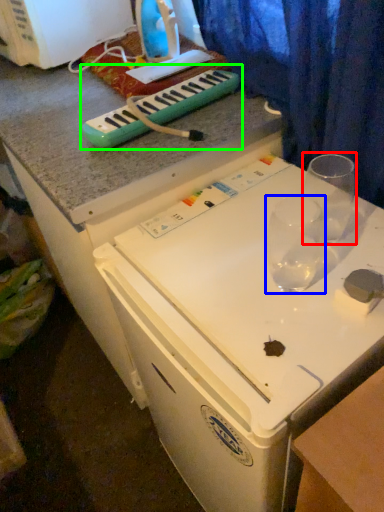
Question: Which object is the farthest from martini glass (highlighted by a red box)? Choose among these: martini glass (highlighted by a blue box) or musical keyboard (highlighted by a green box).

Choices:
 (A) martini glass
 (B) musical keyboard

Answer: (B)